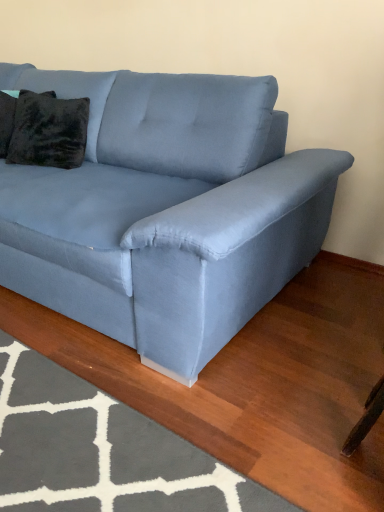
Find the location of a particular element. This screenshot has width=384, height=512. empty space that is to the right of gray textured rug at lower left is located at coordinates (274, 385).